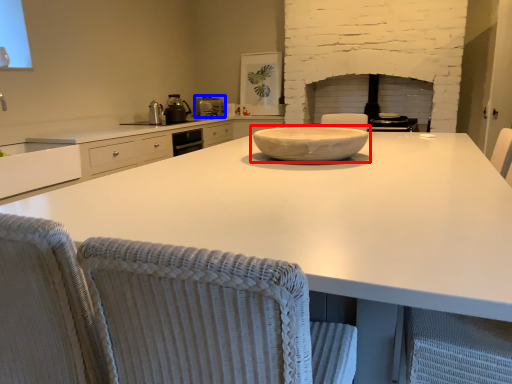
Question: Which of the following is the farthest to the observer, bowl (highlighted by a red box) or kitchen appliance (highlighted by a blue box)?

Choices:
 (A) bowl
 (B) kitchen appliance

Answer: (B)